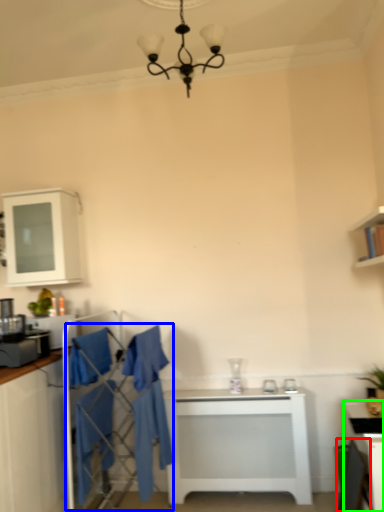
Question: Considering the real-world distances, which object is closest to chair (highlighted by a red box)? swivel chair (highlighted by a blue box) or table (highlighted by a green box).

Choices:
 (A) swivel chair
 (B) table

Answer: (B)